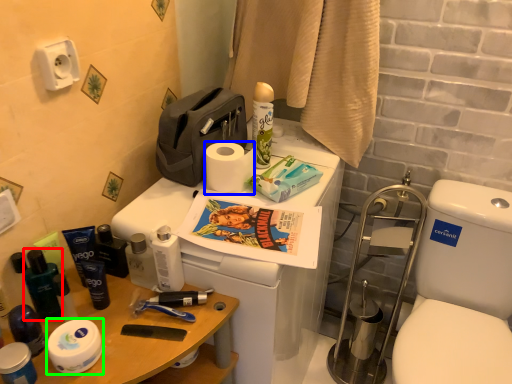
Question: Estimate the real-world distances between objects in this image. Which object is farther from toiletry (highlighted by a red box), toilet paper (highlighted by a blue box) or toilet paper (highlighted by a green box)?

Choices:
 (A) toilet paper
 (B) toilet paper

Answer: (A)